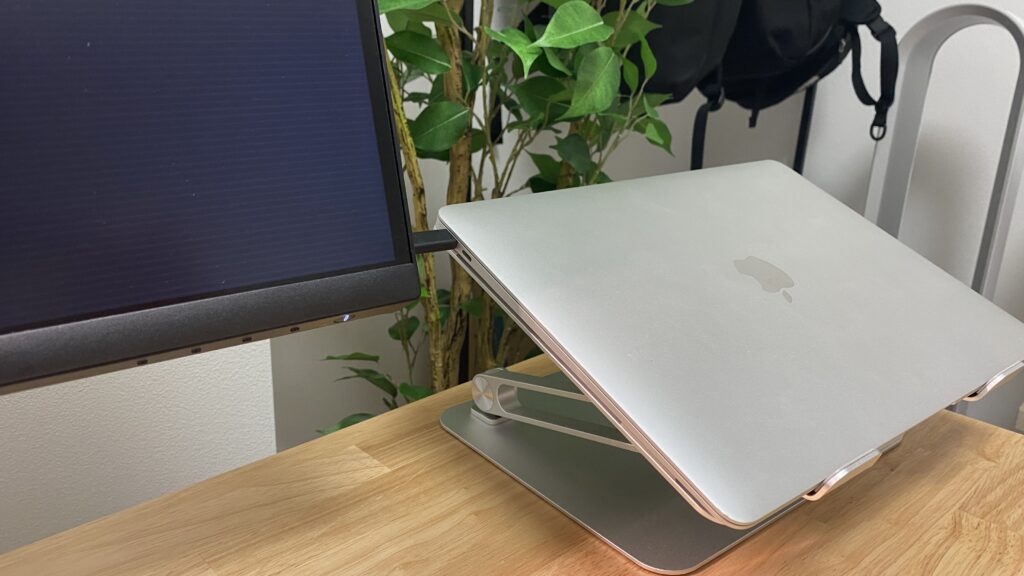
Image resolution: width=1024 pixels, height=576 pixels. Identify the location of monitor screen. (212, 140).